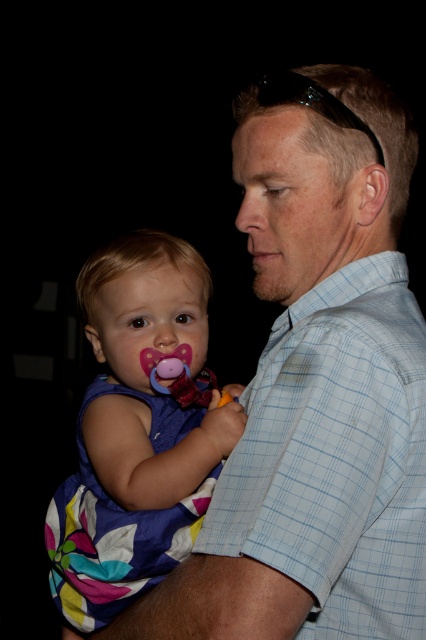
Question: Does light blue checkered shirt at center come behind multicolored fabric dress at left?

Choices:
 (A) yes
 (B) no

Answer: (B)

Question: Which point is closer to the camera?

Choices:
 (A) light blue checkered shirt at center
 (B) multicolored fabric dress at left

Answer: (A)

Question: Can you confirm if light blue checkered shirt at center is wider than multicolored fabric dress at left?

Choices:
 (A) no
 (B) yes

Answer: (B)

Question: Is light blue checkered shirt at center thinner than multicolored fabric dress at left?

Choices:
 (A) no
 (B) yes

Answer: (A)

Question: Which of the following is the farthest from the observer?

Choices:
 (A) multicolored fabric dress at left
 (B) light blue checkered shirt at center

Answer: (A)